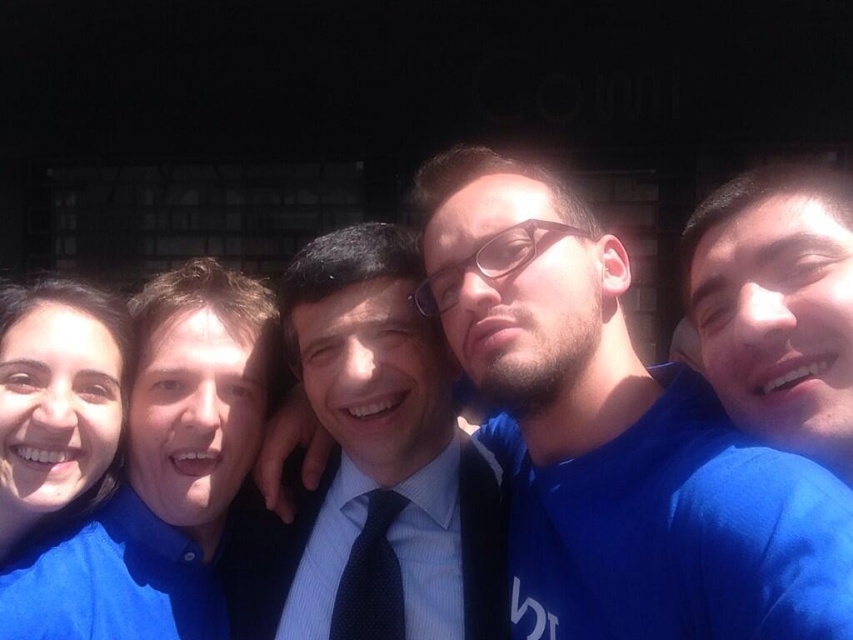
You are trying to identify the person in the front based on their clothing. Which of the two blue shirts, the blue fabric shirt at left or the matte blue shirt at left, is positioned closer to the camera?

The blue fabric shirt at left is positioned closer to the camera because it is in front of the matte blue shirt at left.